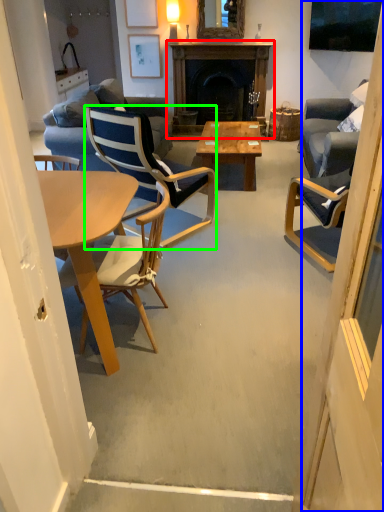
Question: Estimate the real-world distances between objects in this image. Which object is closer to fireplace (highlighted by a red box), screen door (highlighted by a blue box) or chair (highlighted by a green box)?

Choices:
 (A) screen door
 (B) chair

Answer: (B)